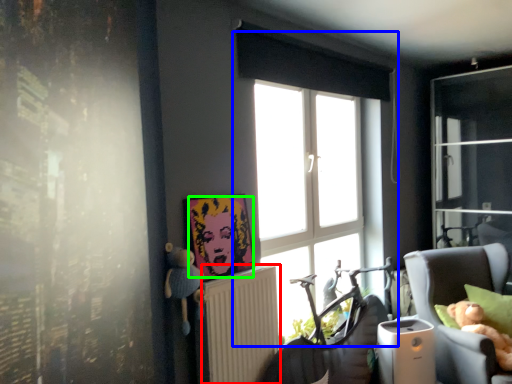
Question: Considering the real-world distances, which object is closest to radiator (highlighted by a red box)? window (highlighted by a blue box) or person (highlighted by a green box).

Choices:
 (A) window
 (B) person

Answer: (B)